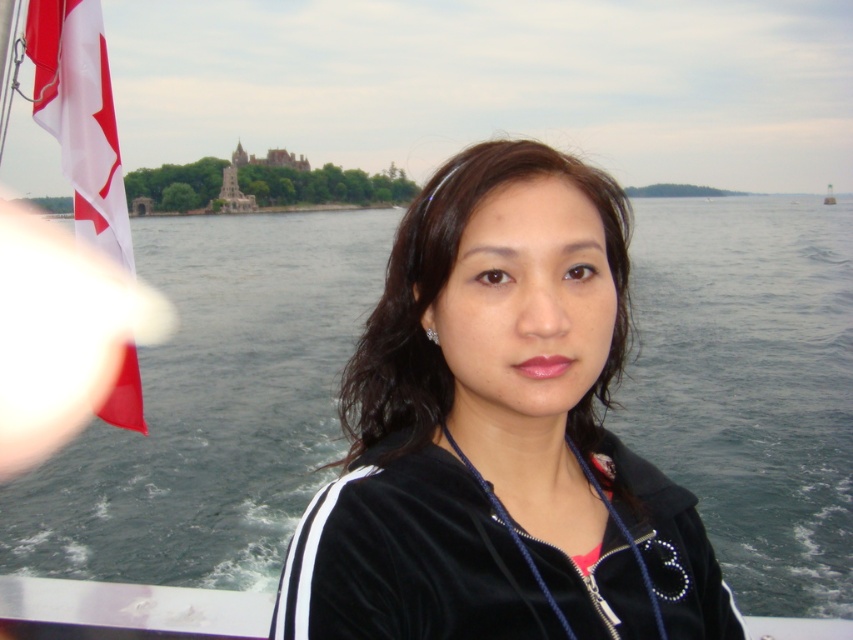
Question: Is black velvety jacket at center thinner than red fabric flag at left?

Choices:
 (A) yes
 (B) no

Answer: (B)

Question: Which point is closer to the camera?

Choices:
 (A) (489, 595)
 (B) (88, 51)

Answer: (A)

Question: Does black velvety jacket at center have a greater width compared to red fabric flag at left?

Choices:
 (A) no
 (B) yes

Answer: (B)

Question: From the image, what is the correct spatial relationship of black velvety jacket at center in relation to red fabric flag at left?

Choices:
 (A) above
 (B) below

Answer: (B)